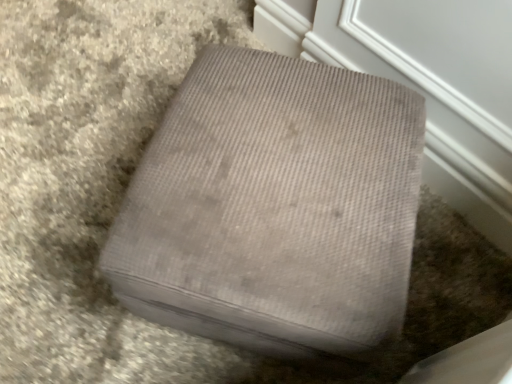
Where is `textured gray ottoman at center`? The image size is (512, 384). textured gray ottoman at center is located at coordinates (274, 207).

What is the approximate width of textured gray ottoman at center?

textured gray ottoman at center is 24.10 inches wide.

What do you see at coordinates (274, 207) in the screenshot? This screenshot has width=512, height=384. I see `textured gray ottoman at center` at bounding box center [274, 207].

Image resolution: width=512 pixels, height=384 pixels. Find the location of `textured gray ottoman at center`. textured gray ottoman at center is located at coordinates (274, 207).